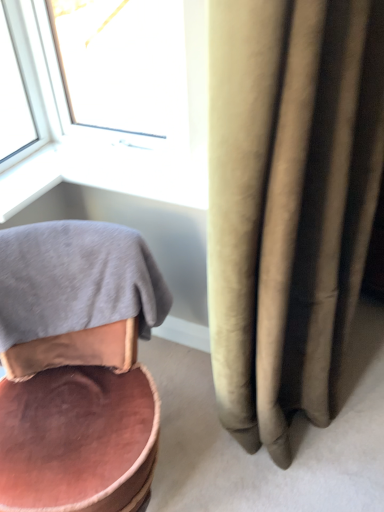
Question: Is white plastic window at upper left wider or thinner than pink velvet chair at lower left?

Choices:
 (A) wide
 (B) thin

Answer: (B)

Question: From the image's perspective, is white plastic window at upper left located above or below pink velvet chair at lower left?

Choices:
 (A) below
 (B) above

Answer: (B)

Question: Estimate the real-world distances between objects in this image. Which object is closer to the gray cotton bath towel at lower left?

Choices:
 (A) pink velvet chair at lower left
 (B) white plastic window at upper left

Answer: (A)

Question: Based on their relative distances, which object is farther from the pink velvet chair at lower left?

Choices:
 (A) white plastic window at upper left
 (B) gray cotton bath towel at lower left

Answer: (A)